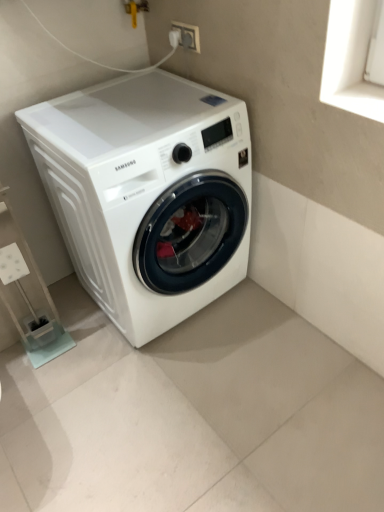
This screenshot has width=384, height=512. What are the coordinates of `free space on the front side of white glossy washing machine at center` in the screenshot? It's located at point(178,395).